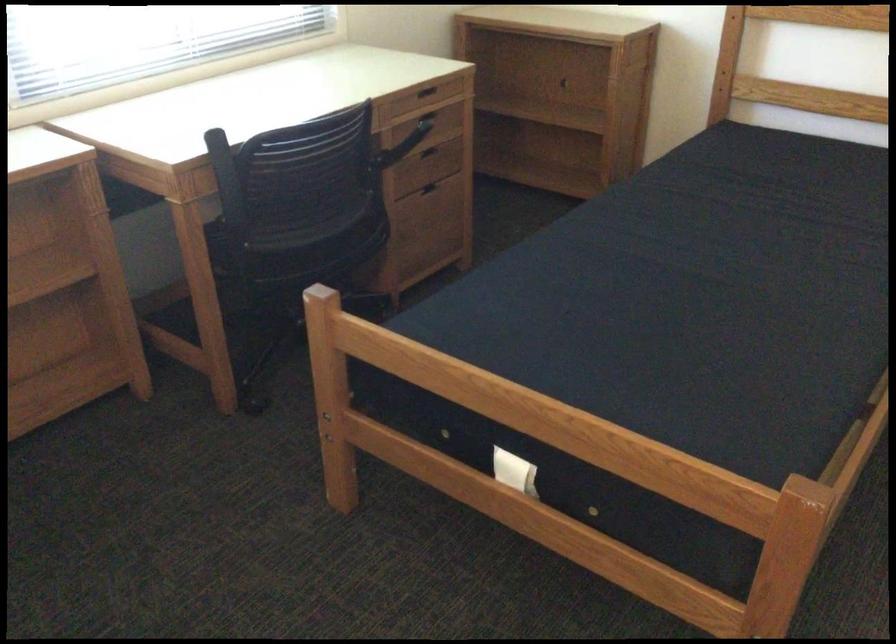
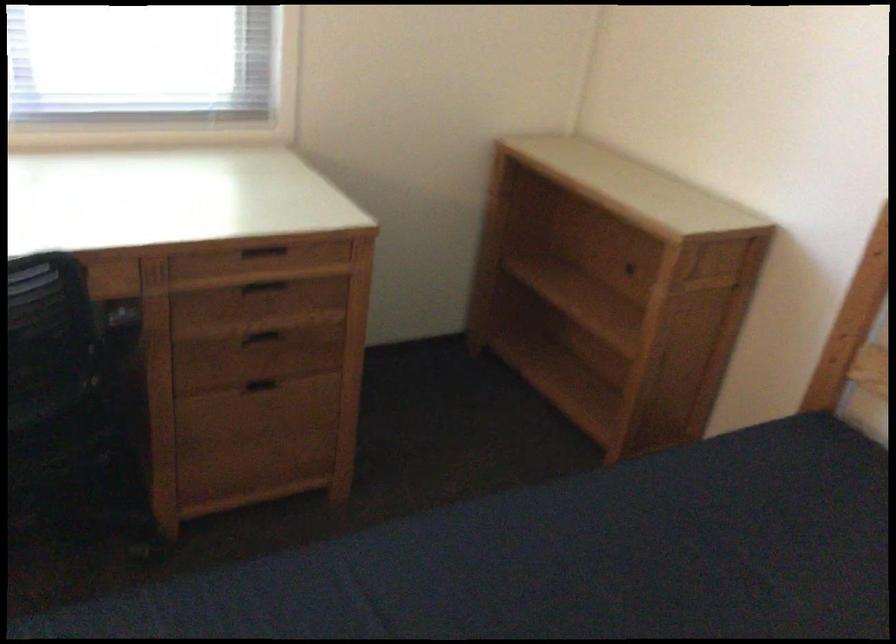
Find the pixel in the second image that matches pixel 423 93 in the first image.

(263, 252)